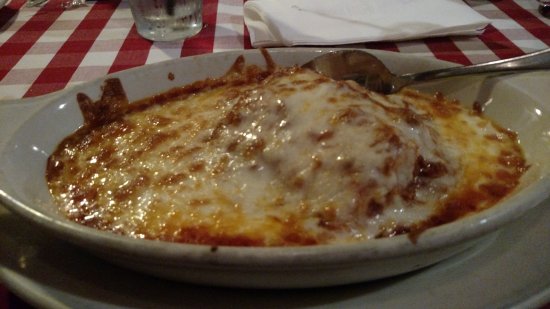
This screenshot has width=550, height=309. In order to click on rad and white table cloth in this screenshot , I will do `click(87, 47)`.